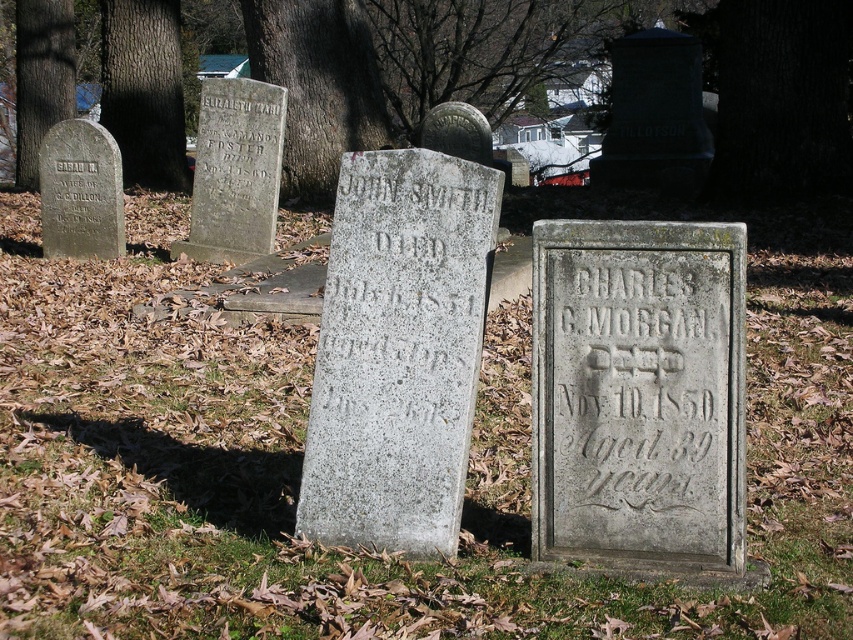
In the scene shown: Is gray stone gravestone at center wider than dark brown bark at upper center?

Incorrect, gray stone gravestone at center's width does not surpass dark brown bark at upper center's.

Does point (329, 540) come closer to viewer compared to point (809, 116)?

Yes, point (329, 540) is in front of point (809, 116).

This screenshot has width=853, height=640. What do you see at coordinates (398, 349) in the screenshot?
I see `gray stone gravestone at center` at bounding box center [398, 349].

You are a GUI agent. You are given a task and a screenshot of the screen. Output one action in this format:
    pyautogui.click(x=<x>, y=<y>)
    Task: Click on the gray stone gravestone at center
    This screenshot has height=640, width=853.
    Given the screenshot: What is the action you would take?
    pyautogui.click(x=398, y=349)

Does smooth bark tree trunk at center appear over brown rough tree trunk at upper left?

Incorrect, smooth bark tree trunk at center is not positioned above brown rough tree trunk at upper left.

Does smooth bark tree trunk at center have a larger size compared to brown rough tree trunk at upper left?

Yes, smooth bark tree trunk at center is bigger than brown rough tree trunk at upper left.

Is point (326, 10) behind point (122, 138)?

No, (326, 10) is in front of (122, 138).

At what (x,y) coordinates should I click in order to perform the action: click on smooth bark tree trunk at center. Please return your answer as a coordinate pair (x, y). The width and height of the screenshot is (853, 640). Looking at the image, I should click on (318, 84).

Describe the element at coordinates (318, 84) in the screenshot. I see `smooth bark tree trunk at center` at that location.

The height and width of the screenshot is (640, 853). What are the coordinates of `smooth bark tree trunk at center` in the screenshot? It's located at coord(318,84).

Where is `smooth bark tree trunk at center`? smooth bark tree trunk at center is located at coordinates (318, 84).